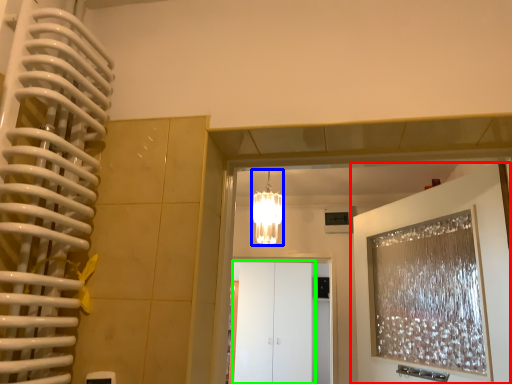
Question: Considering the real-world distances, which object is farthest from door (highlighted by a red box)? lamp (highlighted by a blue box) or glass door (highlighted by a green box)?

Choices:
 (A) lamp
 (B) glass door

Answer: (B)